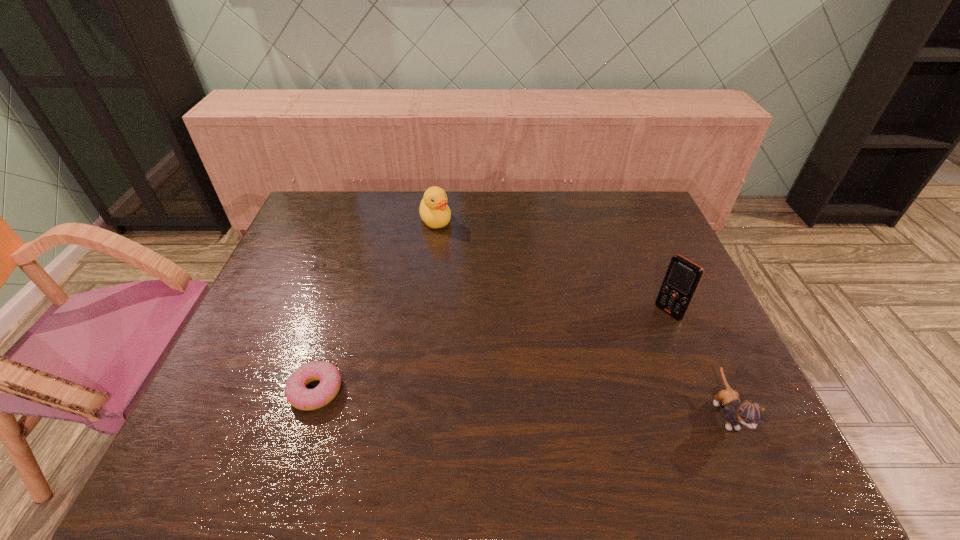
I want to click on vacant space on the desktop that is between the shortest object and the second shortest object and is positioned at the beak of the third object from right to left, so click(x=519, y=402).

This screenshot has height=540, width=960. In order to click on vacant space on the desktop that is between the doughnut and the kitten and is positioned on the screen of the second farthest object in this screenshot , I will do `click(555, 404)`.